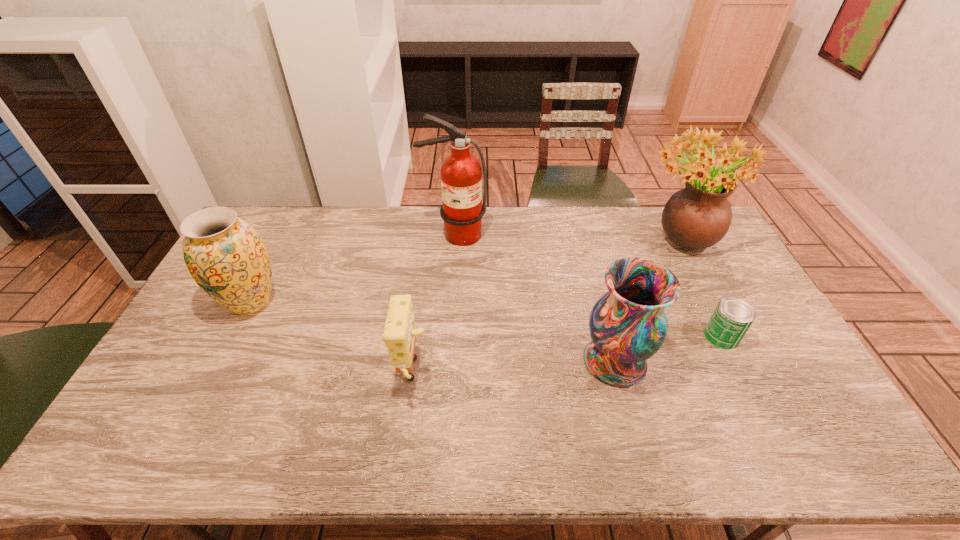
Locate an element on the screen. This screenshot has height=540, width=960. vacant region between the left vase and the second shortest object is located at coordinates (332, 339).

Where is `vacant point located between the can and the leftmost object`? The image size is (960, 540). vacant point located between the can and the leftmost object is located at coordinates (486, 319).

The image size is (960, 540). What are the coordinates of `empty space that is in between the leftmost object and the can` in the screenshot? It's located at (486, 319).

Locate an element on the screen. The width and height of the screenshot is (960, 540). free space between the left vase and the fire extinguisher is located at coordinates click(353, 268).

The width and height of the screenshot is (960, 540). I want to click on blank region between the third object from right to left and the fire extinguisher, so click(x=535, y=298).

Locate an element on the screen. vacant point located between the fourth object from left to right and the shortest object is located at coordinates (668, 349).

I want to click on vacant space that is in between the fire extinguisher and the second tallest object, so click(x=566, y=238).

The image size is (960, 540). I want to click on object that stands as the fourth closest to the fifth shortest object, so click(399, 333).

Select which object is the fifth closest to the third object from right to left. Please provide its 2D coordinates. Your answer should be formatted as a tuple, i.e. [(x, y)], where the tuple contains the x and y coordinates of a point satisfying the conditions above.

[(227, 258)]

You are a GUI agent. You are given a task and a screenshot of the screen. Output one action in this format:
    pyautogui.click(x=<x>, y=<y>)
    Task: Click on the vacant region that satisfies the following two spatial constraints: 1. on the nozzle and handle of the fire extinguisher; 2. on the right side of the right vase
    This screenshot has width=960, height=540.
    Given the screenshot: What is the action you would take?
    pyautogui.click(x=446, y=361)